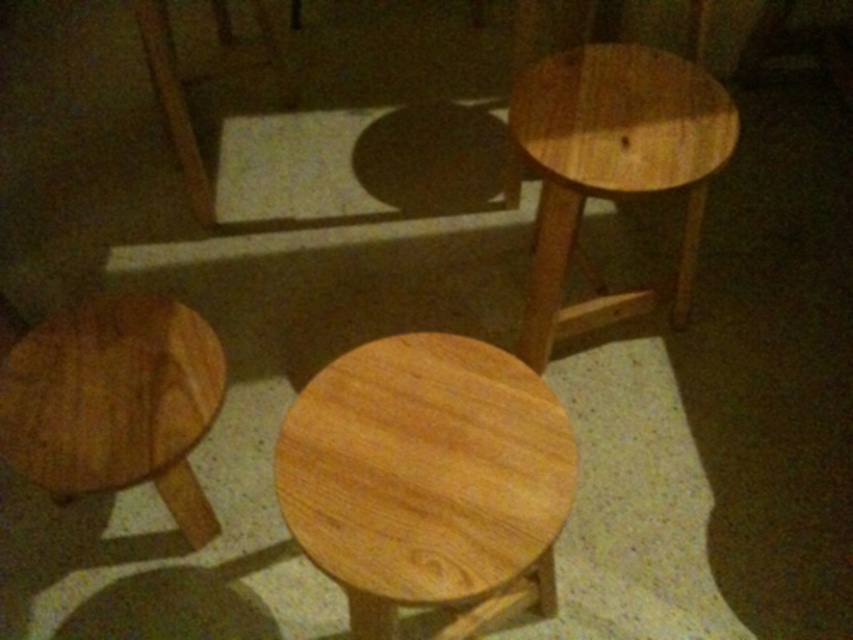
Does natural wood table at center have a lesser height compared to natural wood stool at lower left?

In fact, natural wood table at center may be taller than natural wood stool at lower left.

Between natural wood table at center and natural wood stool at lower left, which one has more height?

natural wood table at center is taller.

Find the location of a particular element. natural wood table at center is located at coordinates (428, 481).

Between natural wood table at center and natural wood stool at upper right, which one appears on the right side from the viewer's perspective?

natural wood stool at upper right

Between natural wood table at center and natural wood stool at upper right, which one appears on the left side from the viewer's perspective?

natural wood table at center is more to the left.

What are the coordinates of `natural wood table at center` in the screenshot? It's located at (428, 481).

Locate an element on the screen. natural wood table at center is located at coordinates (428, 481).

Consider the image. Does natural wood stool at upper right appear under natural wood stool at lower left?

No, natural wood stool at upper right is not below natural wood stool at lower left.

Consider the image. Is natural wood stool at upper right closer to camera compared to natural wood stool at lower left?

No, it is behind natural wood stool at lower left.

Who is more forward, [572,241] or [70,486]?

Point [70,486]

Where is `natural wood stool at upper right`? This screenshot has height=640, width=853. natural wood stool at upper right is located at coordinates (612, 164).